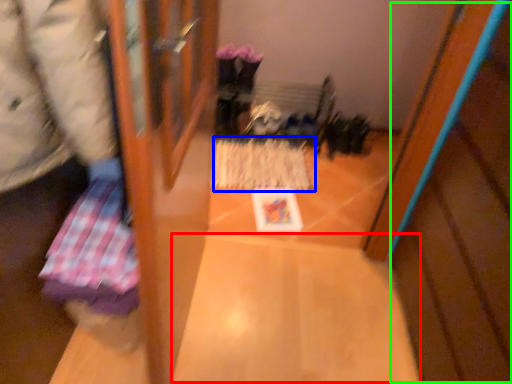
Question: Which is nearer to the wide (highlighted by a red box)? wrapping paper (highlighted by a blue box) or wood (highlighted by a green box).

Choices:
 (A) wrapping paper
 (B) wood

Answer: (B)